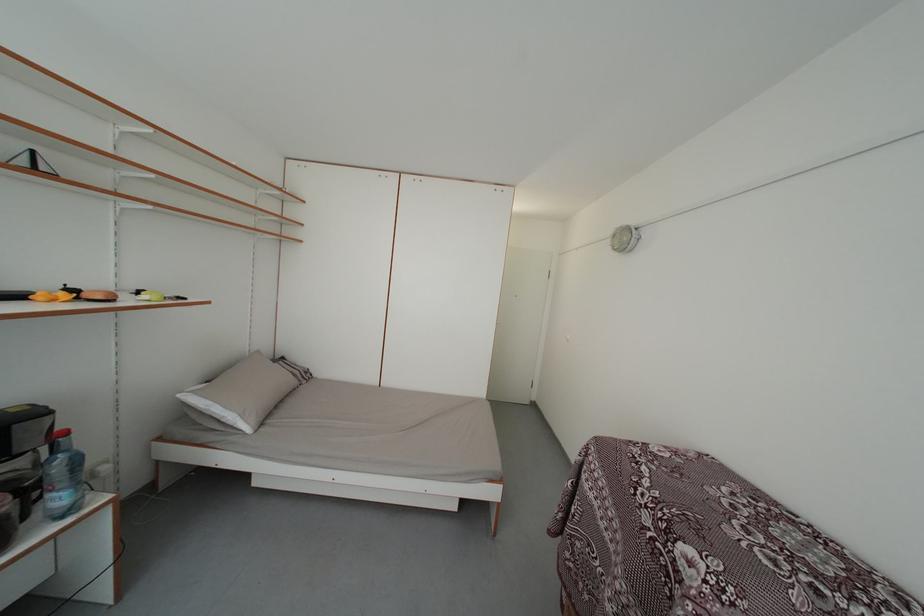
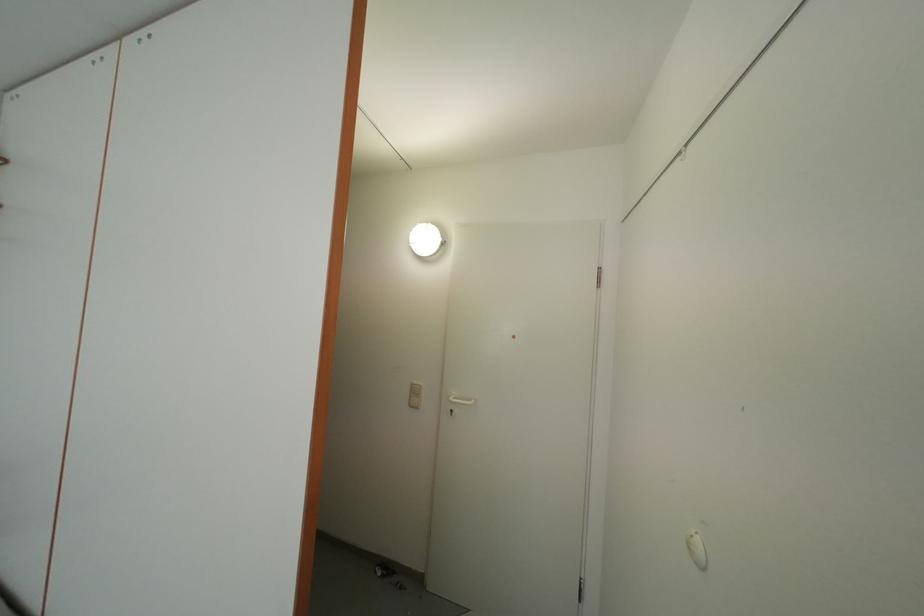
What movement of the cameraman would produce the second image?

The cameraman moved toward right, forward.